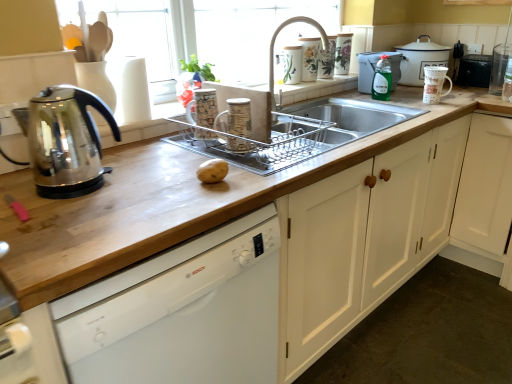
The height and width of the screenshot is (384, 512). Find the location of `free space that is in between matte ceramic mugs at center, the 1th appliance from the left, and transparent glass kettle at left, which appears as the 1th kitchen appliance when ordered from the bottom`. free space that is in between matte ceramic mugs at center, the 1th appliance from the left, and transparent glass kettle at left, which appears as the 1th kitchen appliance when ordered from the bottom is located at coordinates (153, 156).